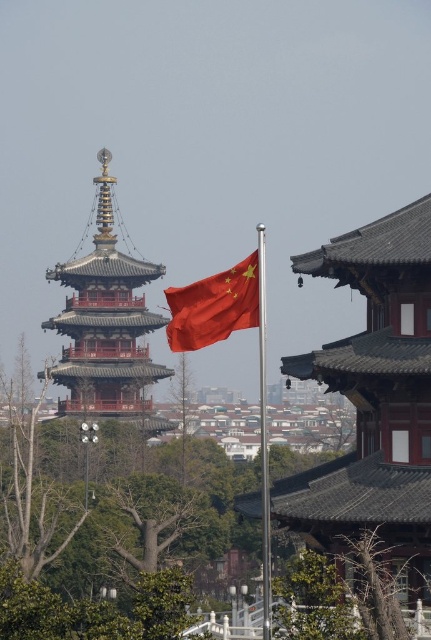
You are standing in front of the pagoda and want to find the green leafy tree at center. Based on the coordinates provided, in which direction should you look relative to the pagoda?

The green leafy tree at center is located at coordinates point (108, 528), which is to the right and slightly forward relative to the pagoda. You should look to the right and slightly forward from the pagoda to find it.

You are a tourist visiting this traditional Chinese pagoda. You notice the red fabric flag at center and the metallic flag pole at center. Which object is taller when viewed from the front?

The metallic flag pole at center is taller than the red fabric flag at center.

From the picture: You are a tourist visiting this traditional Chinese pagoda. You notice a green leafy tree at center and a metallic flag pole at center. Which object is larger in size?

The green leafy tree at center is bigger than the metallic flag pole at center.